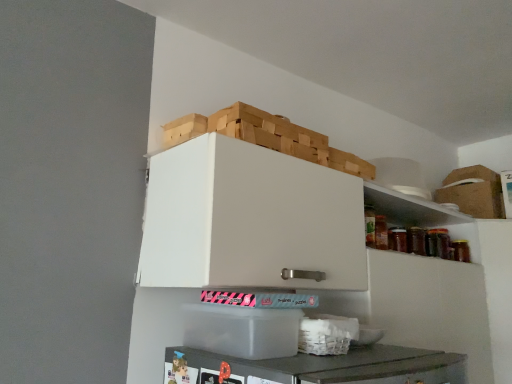
Question: In which direction should I rotate to look at transparent plastic container at lower center, the 2th cardboard box positioned from the top?

Choices:
 (A) left
 (B) right

Answer: (A)

Question: From the image's perspective, is transparent plastic container at lower center, positioned as the 2th cardboard box in back-to-front order, under brown cardboard box at upper right, which is the second cardboard box from left to right?

Choices:
 (A) yes
 (B) no

Answer: (A)

Question: Considering the relative sizes of transparent plastic container at lower center, which appears as the second cardboard box when viewed from the right, and brown cardboard box at upper right, which is the second cardboard box from left to right, in the image provided, is transparent plastic container at lower center, which appears as the second cardboard box when viewed from the right, taller than brown cardboard box at upper right, which is the second cardboard box from left to right,?

Choices:
 (A) no
 (B) yes

Answer: (A)

Question: Could you tell me if transparent plastic container at lower center, the 2th cardboard box positioned from the top, is facing brown cardboard box at upper right, the first cardboard box from the top?

Choices:
 (A) yes
 (B) no

Answer: (B)

Question: Considering the relative sizes of transparent plastic container at lower center, which is counted as the first cardboard box, starting from the left, and brown cardboard box at upper right, the 1th cardboard box from the back, in the image provided, is transparent plastic container at lower center, which is counted as the first cardboard box, starting from the left, bigger than brown cardboard box at upper right, the 1th cardboard box from the back,?

Choices:
 (A) yes
 (B) no

Answer: (B)

Question: Would you say transparent plastic container at lower center, which is counted as the first cardboard box, starting from the left, contains brown cardboard box at upper right, which is the second cardboard box from left to right?

Choices:
 (A) no
 (B) yes

Answer: (A)

Question: From a real-world perspective, is transparent plastic container at lower center, the 2th cardboard box positioned from the top, positioned under brown cardboard box at upper right, placed as the first cardboard box when sorted from right to left, based on gravity?

Choices:
 (A) no
 (B) yes

Answer: (B)

Question: Can you confirm if white woven basket at lower center is positioned to the right of wooden crate at upper center?

Choices:
 (A) yes
 (B) no

Answer: (A)

Question: From the image's perspective, is white woven basket at lower center beneath wooden crate at upper center?

Choices:
 (A) yes
 (B) no

Answer: (A)

Question: Does white woven basket at lower center have a larger size compared to wooden crate at upper center?

Choices:
 (A) no
 (B) yes

Answer: (A)

Question: Is white woven basket at lower center far from wooden crate at upper center?

Choices:
 (A) no
 (B) yes

Answer: (A)

Question: Does white woven basket at lower center appear on the left side of wooden crate at upper center?

Choices:
 (A) no
 (B) yes

Answer: (A)

Question: Does white woven basket at lower center come in front of wooden crate at upper center?

Choices:
 (A) yes
 (B) no

Answer: (A)

Question: From the image's perspective, is transparent plastic container at lower center, the first cardboard box when ordered from front to back, under white woven basket at lower center?

Choices:
 (A) yes
 (B) no

Answer: (B)